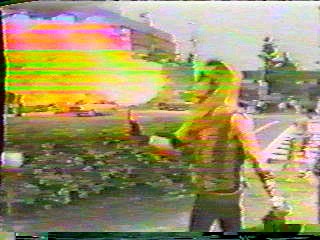
You are a GUI agent. You are given a task and a screenshot of the screen. Output one action in this format:
    pyautogui.click(x=<x>, y=<y>)
    Task: Click on the pink/white light
    This screenshot has width=320, height=240.
    Given the screenshot: What is the action you would take?
    pyautogui.click(x=132, y=96)